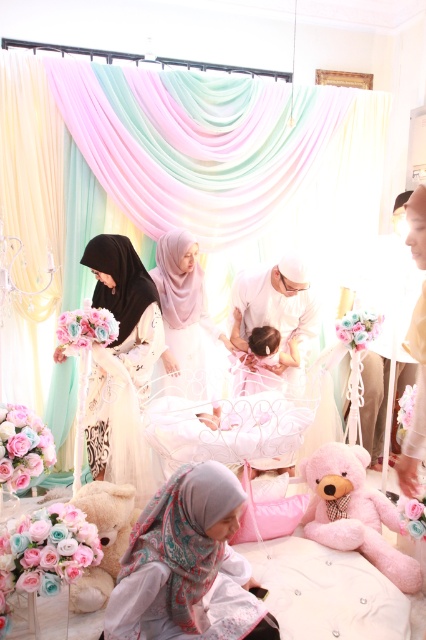
You are a photographer positioned at the center of the room. You want to take a photo of the matte white dress at center. Based on its position coordinates, where should you aim your camera?

The matte white dress at center is located at coordinates point (184,317), so you should aim your camera towards that point to capture it.

You are a photographer setting up for a baby naming ceremony. You need to ensure that the pale pink fabric hijab at center and the fluffy pink teddy bear at lower right are both visible in the frame. Given their sizes, which object should you position closer to the camera to maintain their visibility?

The fluffy pink teddy bear at lower right should be positioned closer to the camera because it is smaller than the pale pink fabric hijab at center. This way, both objects will appear similarly sized in the photo.